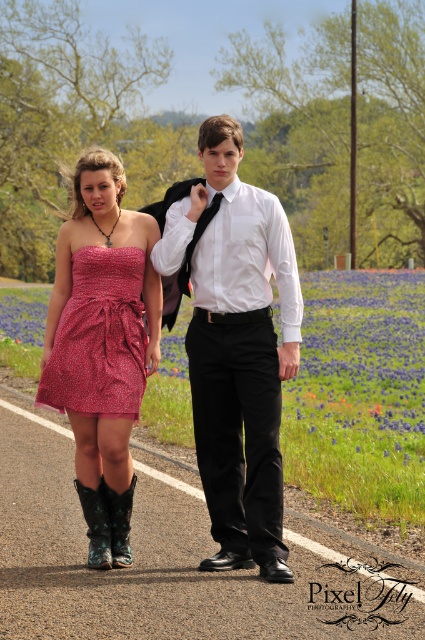
You are planning to take a photo of the purple fabric flower field at center and the red satin dress at center. Which object should you focus on first if you want to capture both in the same frame without moving the camera?

The purple fabric flower field at center might be wider than the red satin dress at center, so you should focus on the purple fabric flower field at center first to ensure it fits within the frame.

You are a photographer setting up a shoot on a scenic road. You have two props to place in the scene for a photo shoot. The first prop is a white smooth shirt at center and the second is a green suede cowboy boot at lower left. The shirt is taller than the boot. You want to ensure that the taller prop is placed in the foreground to draw attention. Which prop should you place closer to the camera?

The white smooth shirt at center is taller than the green suede cowboy boot at lower left, so to place the taller prop in the foreground, you should position the white smooth shirt at center closer to the camera.

You are standing on the paved road where the two people are located. You want to walk to the purple fabric flower field at center. Which direction should you walk? Please answer with a direction like north, south, east, west, or a combination like northeast.

The purple fabric flower field at center is located at point coordinates 0.616 on the x axis and 0.847 on the y axis. Since the x coordinate is greater than 0.5, it is to the east. The y coordinate is also greater than 0.5, so it is to the north. Therefore, you should walk northeast.